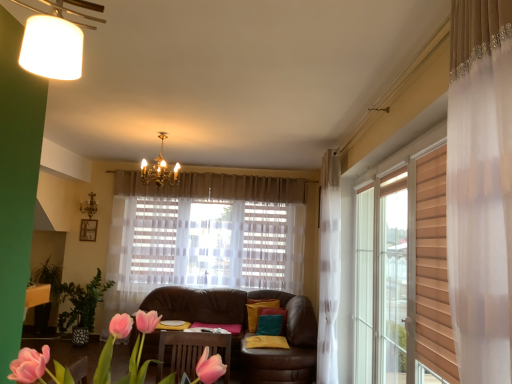
Describe the element at coordinates (246, 329) in the screenshot. I see `brown leather couch at center` at that location.

This screenshot has height=384, width=512. I want to click on brown leather couch at center, so click(x=246, y=329).

What is the approximate height of pink fabric flowers at lower left?

28.04 inches.

This screenshot has height=384, width=512. Find the location of `pink fabric flowers at lower left`. pink fabric flowers at lower left is located at coordinates (37, 367).

What is the approximate width of pink fabric flowers at lower left?

It is 1.37 meters.

What do you see at coordinates (37, 367) in the screenshot? The width and height of the screenshot is (512, 384). I see `pink fabric flowers at lower left` at bounding box center [37, 367].

In order to face pink fabric flowers at lower left, should I rotate leftwards or rightwards?

To align with it, rotate left about 20.088°.

Find the location of a particular element. The width and height of the screenshot is (512, 384). brown leather couch at center is located at coordinates (246, 329).

Can you confirm if pink fabric flowers at lower left is positioned to the left of brown leather couch at center?

Yes, pink fabric flowers at lower left is to the left of brown leather couch at center.

Is the position of pink fabric flowers at lower left less distant than that of brown leather couch at center?

Yes, it is.

Between point (132, 357) and point (291, 353), which one is positioned behind?

The point (291, 353) is farther from the camera.

From the image's perspective, is pink fabric flowers at lower left above or below brown leather couch at center?

From the image's perspective, pink fabric flowers at lower left appears above brown leather couch at center.

From a real-world perspective, which object stands above the other?

pink fabric flowers at lower left.

Considering the sizes of objects pink fabric flowers at lower left and brown leather couch at center in the image provided, who is thinner, pink fabric flowers at lower left or brown leather couch at center?

With smaller width is brown leather couch at center.

Between pink fabric flowers at lower left and brown leather couch at center, which one has more height?

With more height is brown leather couch at center.

Can you confirm if pink fabric flowers at lower left is smaller than brown leather couch at center?

No, pink fabric flowers at lower left is not smaller than brown leather couch at center.

Is brown leather couch at center inside pink fabric flowers at lower left?

No, pink fabric flowers at lower left does not contain brown leather couch at center.

Is pink fabric flowers at lower left not near brown leather couch at center?

Absolutely, pink fabric flowers at lower left is distant from brown leather couch at center.

Is brown leather couch at center at the back of pink fabric flowers at lower left?

No, pink fabric flowers at lower left is not facing the opposite direction of brown leather couch at center.

How many degrees apart are the facing directions of pink fabric flowers at lower left and brown leather couch at center?

They differ by 180 degrees in their facing directions.

I want to click on studio couch lying behind the pink fabric flowers at lower left, so click(246, 329).

Which object is positioned more to the right, brown leather couch at center or pink fabric flowers at lower left?

brown leather couch at center.

Is the position of brown leather couch at center more distant than that of pink fabric flowers at lower left?

Yes, brown leather couch at center is further from the viewer.

Which is more distant, (290, 361) or (27, 382)?

Point (290, 361)

From the image's perspective, would you say brown leather couch at center is shown under pink fabric flowers at lower left?

Correct, brown leather couch at center appears lower than pink fabric flowers at lower left in the image.

From a real-world perspective, between brown leather couch at center and pink fabric flowers at lower left, who is vertically higher?

From a 3D spatial view, pink fabric flowers at lower left is above.

Does brown leather couch at center have a lesser width compared to pink fabric flowers at lower left?

Correct, the width of brown leather couch at center is less than that of pink fabric flowers at lower left.

From their relative heights in the image, would you say brown leather couch at center is taller or shorter than pink fabric flowers at lower left?

Clearly, brown leather couch at center is taller compared to pink fabric flowers at lower left.

Can you confirm if brown leather couch at center is bigger than pink fabric flowers at lower left?

Actually, brown leather couch at center might be smaller than pink fabric flowers at lower left.

Is brown leather couch at center located outside pink fabric flowers at lower left?

Yes.

Is brown leather couch at center placed right next to pink fabric flowers at lower left?

brown leather couch at center and pink fabric flowers at lower left are clearly separated.

Is brown leather couch at center oriented towards pink fabric flowers at lower left?

Yes, brown leather couch at center is aimed at pink fabric flowers at lower left.

Measure the distance between brown leather couch at center and pink fabric flowers at lower left.

brown leather couch at center and pink fabric flowers at lower left are 2.99 meters apart.

Locate an element on the screen. studio couch behind the pink fabric flowers at lower left is located at coordinates (246, 329).

In the image, there is a pink fabric flowers at lower left. Where is `studio couch below it (from the image's perspective)`? studio couch below it (from the image's perspective) is located at coordinates (246, 329).

The height and width of the screenshot is (384, 512). Find the location of `floral arrangement in front of the brown leather couch at center`. floral arrangement in front of the brown leather couch at center is located at coordinates (37, 367).